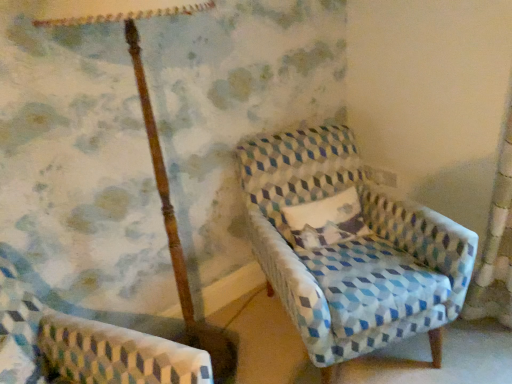
Question: Looking at the image, does textured cream pillow at center seem bigger or smaller compared to textured blue and white armchair at center, which is the 1th chair from right to left?

Choices:
 (A) small
 (B) big

Answer: (A)

Question: Is textured cream pillow at center spatially inside textured blue and white armchair at center, which is the 1th chair from right to left, or outside of it?

Choices:
 (A) outside
 (B) inside

Answer: (B)

Question: Which object is the farthest from the wooden pole at upper left?

Choices:
 (A) textured cream pillow at center
 (B) patterned fabric armchair at lower left, marked as the second chair in a right-to-left arrangement
 (C) textured blue and white armchair at center, which is the 1th chair from right to left

Answer: (C)

Question: Which object is positioned farthest from the patterned fabric armchair at lower left, which appears as the first chair when viewed from the left?

Choices:
 (A) wooden pole at upper left
 (B) textured cream pillow at center
 (C) textured blue and white armchair at center, which is counted as the second chair, starting from the left

Answer: (B)